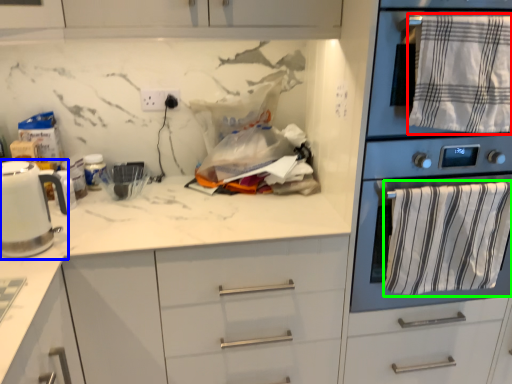
Question: Which is farther away from bath towel (highlighted by a red box)? kitchen appliance (highlighted by a blue box) or bath towel (highlighted by a green box)?

Choices:
 (A) kitchen appliance
 (B) bath towel

Answer: (A)